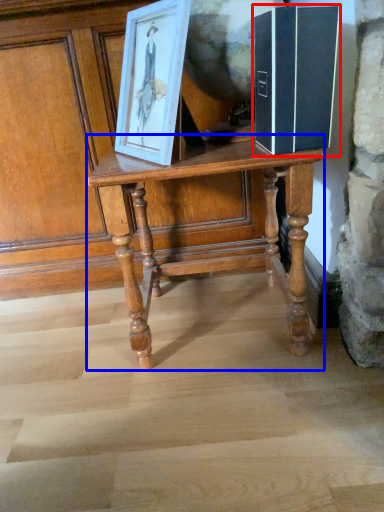
Question: Among these objects, which one is farthest to the camera, book (highlighted by a red box) or table (highlighted by a blue box)?

Choices:
 (A) book
 (B) table

Answer: (B)